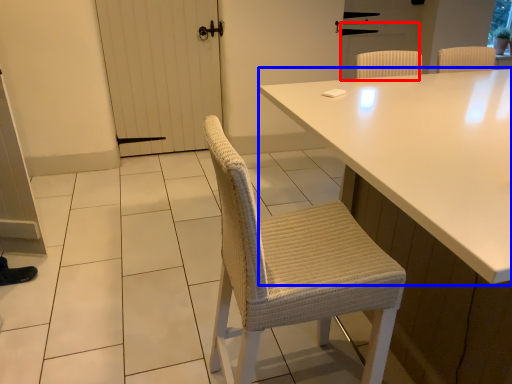
Question: Which object appears closest to the camera in this image, screen door (highlighted by a red box) or table (highlighted by a blue box)?

Choices:
 (A) screen door
 (B) table

Answer: (B)